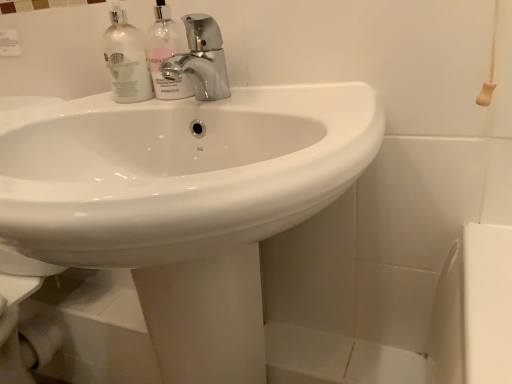
Question: Should I look upward or downward to see translucent glass bottles at upper left, which is counted as the 1th cleaning product, starting from the left?

Choices:
 (A) down
 (B) up

Answer: (B)

Question: Considering the relative sizes of clear glass bottle at upper center, positioned as the second cleaning product in left-to-right order, and translucent glass bottles at upper left, which is counted as the 1th cleaning product, starting from the left, in the image provided, is clear glass bottle at upper center, positioned as the second cleaning product in left-to-right order, taller than translucent glass bottles at upper left, which is counted as the 1th cleaning product, starting from the left,?

Choices:
 (A) no
 (B) yes

Answer: (B)

Question: Is clear glass bottle at upper center, positioned as the second cleaning product in left-to-right order, oriented away from translucent glass bottles at upper left, which is the second cleaning product from right to left?

Choices:
 (A) yes
 (B) no

Answer: (B)

Question: From the image's perspective, would you say clear glass bottle at upper center, which is counted as the first cleaning product, starting from the right, is shown under translucent glass bottles at upper left, which is the second cleaning product from right to left?

Choices:
 (A) no
 (B) yes

Answer: (A)

Question: Would you say clear glass bottle at upper center, which is counted as the first cleaning product, starting from the right, is a long distance from translucent glass bottles at upper left, which is counted as the 1th cleaning product, starting from the left?

Choices:
 (A) no
 (B) yes

Answer: (A)

Question: From a real-world perspective, is clear glass bottle at upper center, positioned as the second cleaning product in left-to-right order, on translucent glass bottles at upper left, which is the second cleaning product from right to left?

Choices:
 (A) yes
 (B) no

Answer: (A)

Question: Is clear glass bottle at upper center, which is counted as the first cleaning product, starting from the right, oriented towards translucent glass bottles at upper left, which is the second cleaning product from right to left?

Choices:
 (A) no
 (B) yes

Answer: (A)

Question: Considering the relative sizes of translucent glass bottles at upper left, which is the second cleaning product from right to left, and chrome metallic faucet at center in the image provided, is translucent glass bottles at upper left, which is the second cleaning product from right to left, bigger than chrome metallic faucet at center?

Choices:
 (A) yes
 (B) no

Answer: (B)

Question: Does translucent glass bottles at upper left, which is counted as the 1th cleaning product, starting from the left, come in front of chrome metallic faucet at center?

Choices:
 (A) no
 (B) yes

Answer: (A)

Question: From the image's perspective, is translucent glass bottles at upper left, which is counted as the 1th cleaning product, starting from the left, beneath chrome metallic faucet at center?

Choices:
 (A) no
 (B) yes

Answer: (A)

Question: Is translucent glass bottles at upper left, which is the second cleaning product from right to left, outside of chrome metallic faucet at center?

Choices:
 (A) no
 (B) yes

Answer: (B)

Question: Does translucent glass bottles at upper left, which is the second cleaning product from right to left, appear on the right side of chrome metallic faucet at center?

Choices:
 (A) yes
 (B) no

Answer: (B)

Question: Is translucent glass bottles at upper left, which is the second cleaning product from right to left, taller than chrome metallic faucet at center?

Choices:
 (A) yes
 (B) no

Answer: (A)

Question: From a real-world perspective, is translucent glass bottles at upper left, which is the second cleaning product from right to left, on top of clear glass bottle at upper center, which is counted as the first cleaning product, starting from the right?

Choices:
 (A) yes
 (B) no

Answer: (B)